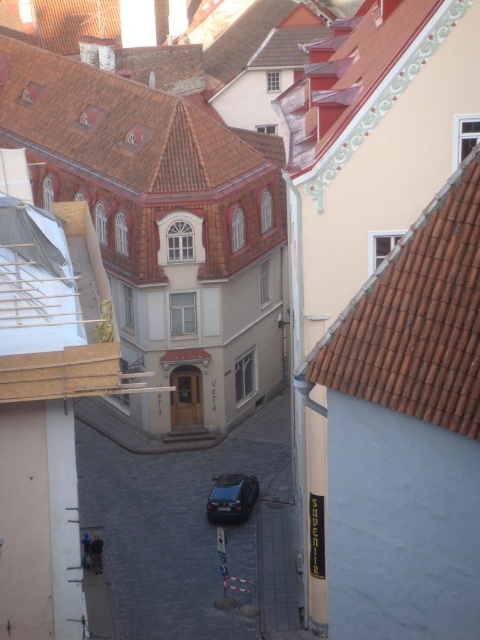
Question: Which object is the closest to the brown tile roof at upper right?

Choices:
 (A) shiny black car at center
 (B) dark gray cobblestone alley at center

Answer: (B)

Question: Is dark gray cobblestone alley at center positioned before brown tile roof at upper right?

Choices:
 (A) yes
 (B) no

Answer: (B)

Question: Can you confirm if dark gray cobblestone alley at center is positioned to the left of brown tile roof at upper right?

Choices:
 (A) no
 (B) yes

Answer: (B)

Question: Among these objects, which one is farthest from the camera?

Choices:
 (A) brown tiled roof at upper center
 (B) brown tile roof at upper right
 (C) dark gray cobblestone alley at center

Answer: (A)

Question: Is brown tile roof at upper right positioned behind shiny black car at center?

Choices:
 (A) no
 (B) yes

Answer: (A)

Question: Which object appears farthest from the camera in this image?

Choices:
 (A) shiny black car at center
 (B) dark gray cobblestone alley at center
 (C) brown tile roof at upper right
 (D) brown tiled roof at upper center

Answer: (D)